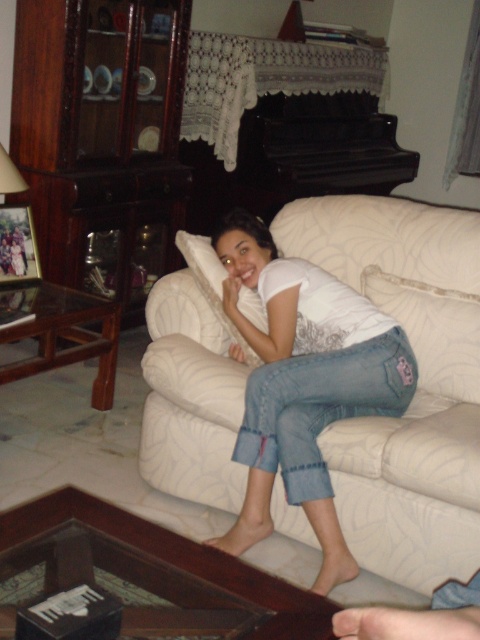
You are a guest in this living room and want to sit on the sofa. There are two pillows here, the white fabric pillow at lower center and the white soft pillow at center. Which pillow is closer to you when you first sit down?

The white fabric pillow at lower center is closer to you because it is in front of the white soft pillow at center when you sit down.

Looking at this image, you are a person who wants to lay down on the white fabric couch at center. Can you do so without the white soft pillow at center getting in the way?

The white fabric couch at center is much taller than the white soft pillow at center, so the pillow is likely positioned lower and won